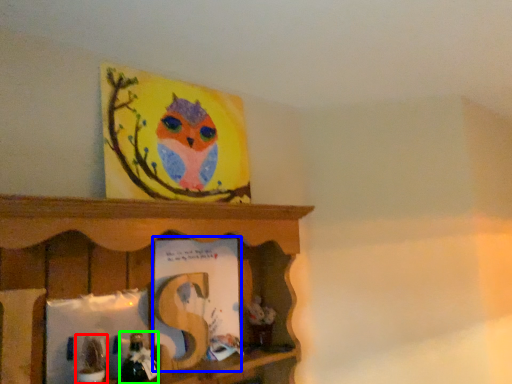
Question: Which object is positioned farthest from toy (highlighted by a red box)? Select from book (highlighted by a blue box) and toy (highlighted by a green box).

Choices:
 (A) book
 (B) toy

Answer: (A)